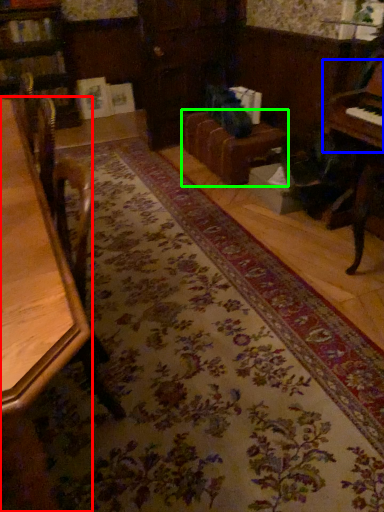
Question: Based on their relative distances, which object is farther from table (highlighted by a red box)? Choose from piano (highlighted by a blue box) and couch (highlighted by a green box).

Choices:
 (A) piano
 (B) couch

Answer: (B)